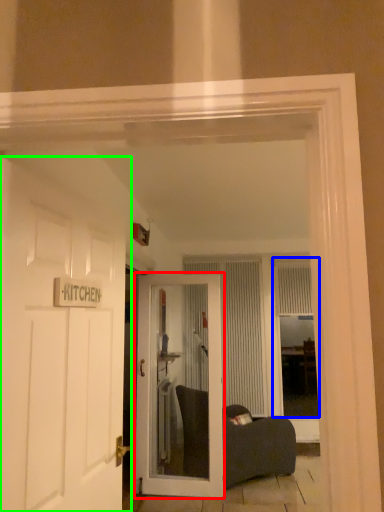
Question: Based on their relative distances, which object is farther from door (highlighted by a red box)? Choose from window (highlighted by a blue box) and door (highlighted by a green box).

Choices:
 (A) window
 (B) door

Answer: (B)